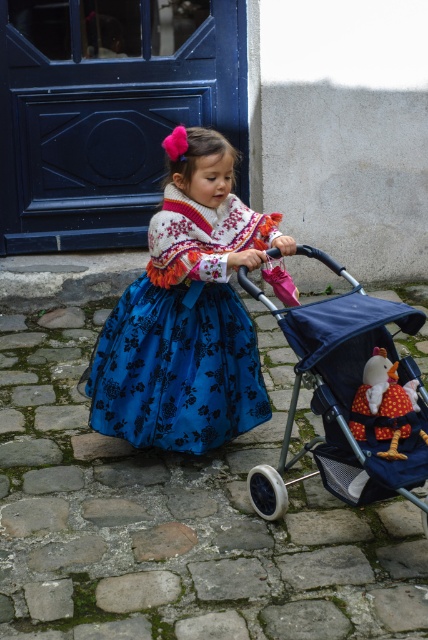
Question: Is blue satin dress at center smaller than velvet plush doll at center?

Choices:
 (A) yes
 (B) no

Answer: (B)

Question: Which point is closer to the camera?

Choices:
 (A) (354, 436)
 (B) (199, 301)

Answer: (A)

Question: Which point is closer to the camera taking this photo?

Choices:
 (A) click(213, 348)
 (B) click(326, 403)

Answer: (B)

Question: Does blue satin dress at center appear under velvet plush doll at center?

Choices:
 (A) yes
 (B) no

Answer: (B)

Question: Estimate the real-world distances between objects in this image. Which object is closer to the matte blue stroller at center?

Choices:
 (A) blue satin dress at center
 (B) velvet plush doll at center

Answer: (B)

Question: Where is blue satin dress at center located in relation to matte blue stroller at center in the image?

Choices:
 (A) above
 (B) below

Answer: (A)